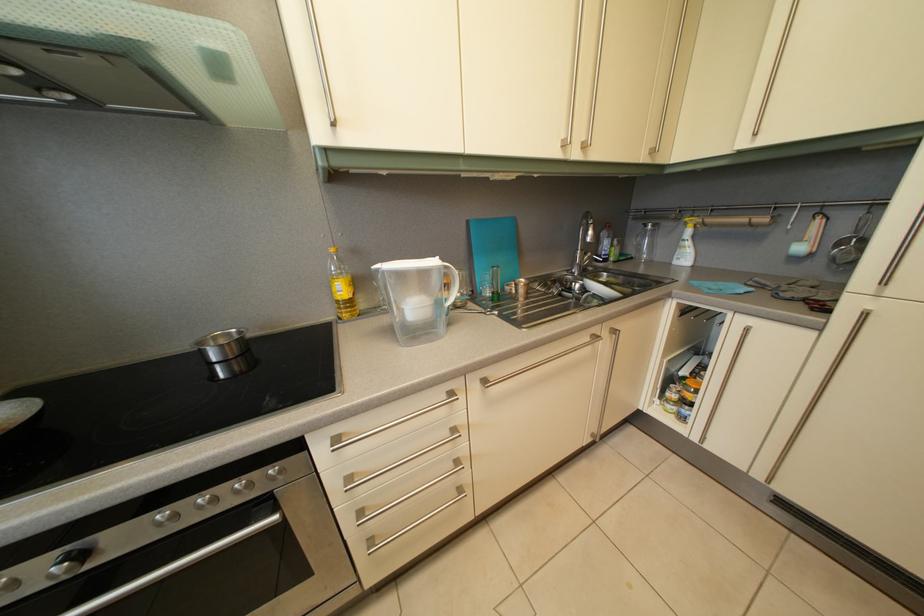
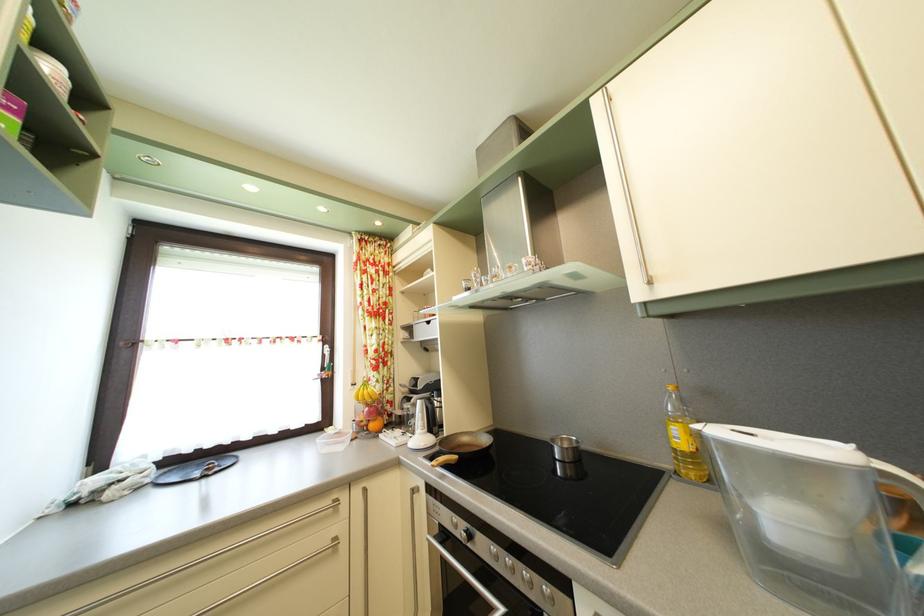
Locate, in the second image, the point that corresponds to (421,315) in the first image.

(793, 528)